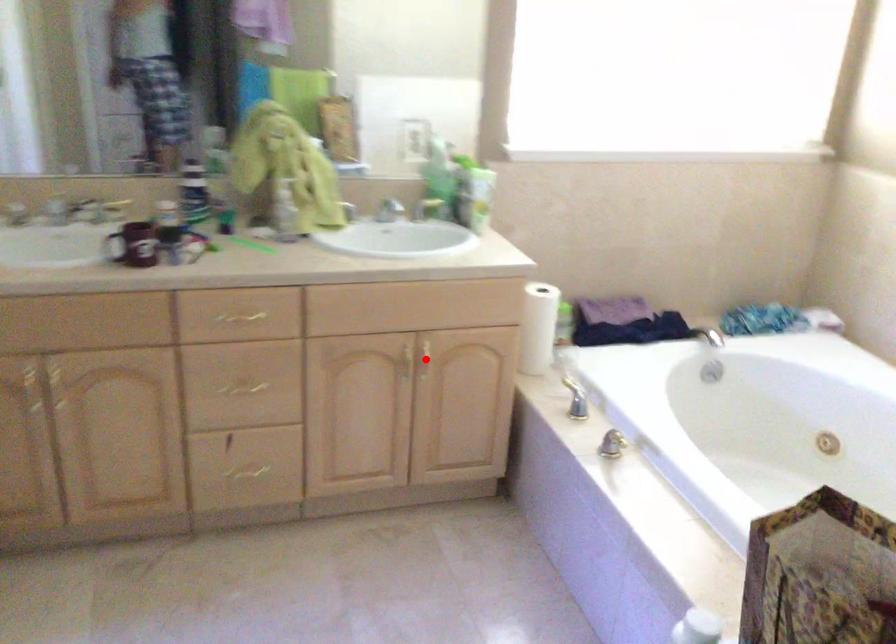
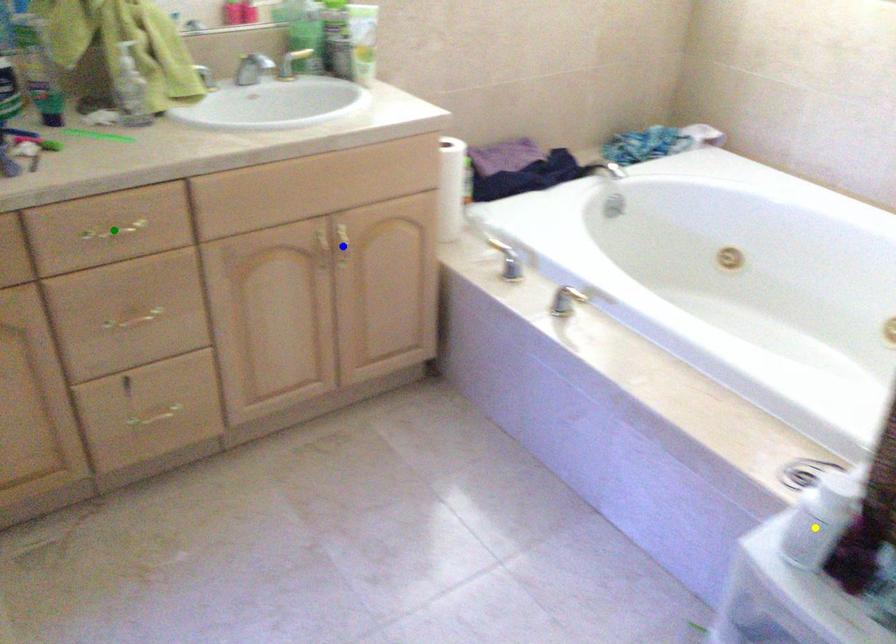
Question: I am providing you with two images of the same scene from different viewpoints. A red point is marked on the first image. You are given multiple points on the second image. Which point in image 2 represents the same 3d spot as the red point in image 1?

Choices:
 (A) yellow point
 (B) blue point
 (C) green point

Answer: (B)